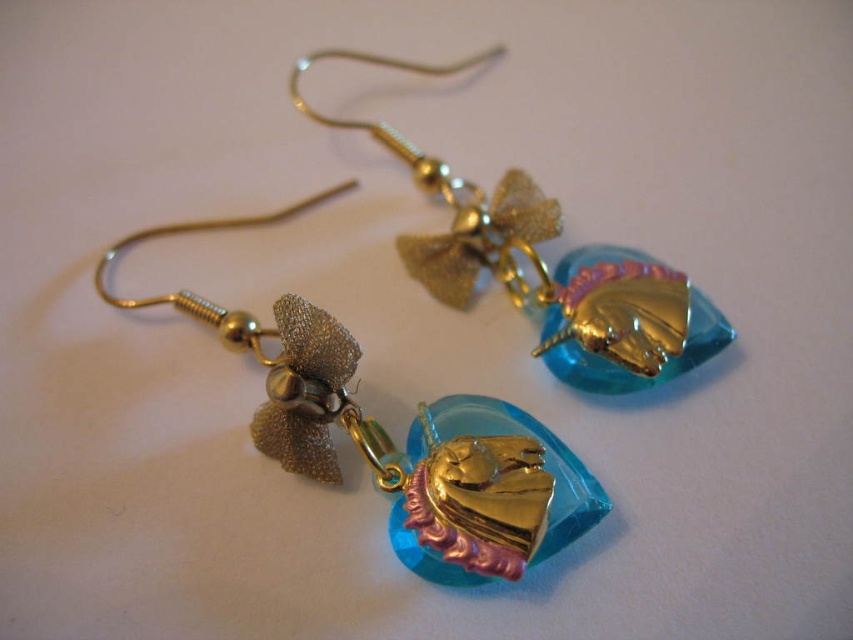
Question: Where is translucent blue glass heart at center located in relation to translucent blue glass pendant at center in the image?

Choices:
 (A) left
 (B) right

Answer: (A)

Question: Among these points, which one is nearest to the camera?

Choices:
 (A) (346, 397)
 (B) (619, 253)

Answer: (A)

Question: Does translucent blue glass heart at center appear on the left side of translucent blue glass pendant at center?

Choices:
 (A) yes
 (B) no

Answer: (A)

Question: Which point is closer to the camera?

Choices:
 (A) translucent blue glass heart at center
 (B) translucent blue glass pendant at center

Answer: (A)

Question: Which object is closer to the camera taking this photo?

Choices:
 (A) translucent blue glass pendant at center
 (B) translucent blue glass heart at center

Answer: (B)

Question: Is translucent blue glass heart at center in front of translucent blue glass pendant at center?

Choices:
 (A) no
 (B) yes

Answer: (B)